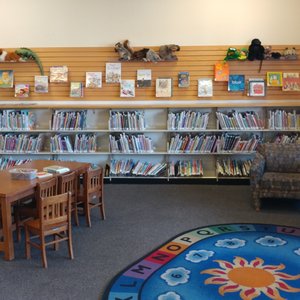
Locate an element on the screen. This screenshot has height=300, width=300. orange rug square is located at coordinates (183, 247).